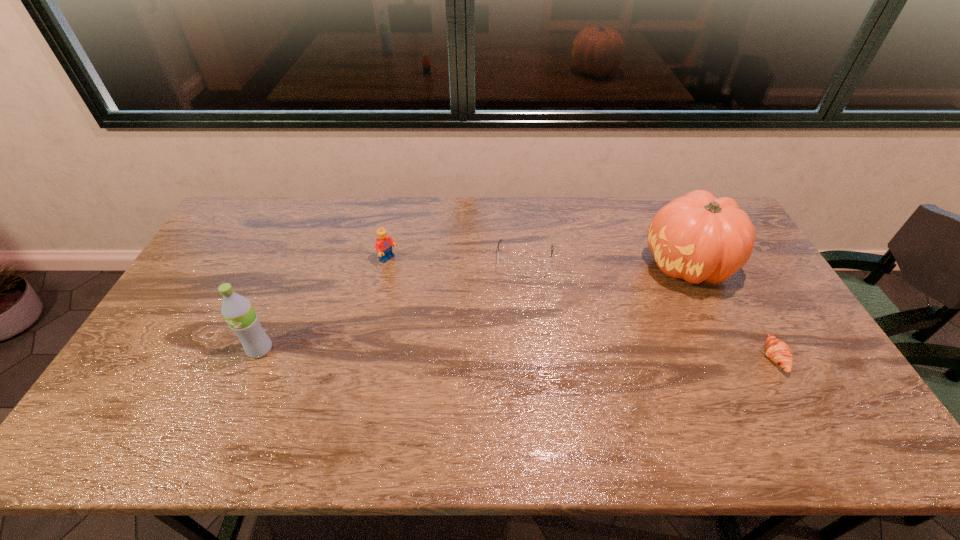
Locate an element on the screen. This screenshot has width=960, height=540. object at the far edge is located at coordinates (697, 237).

What are the coordinates of `pastry positioned at the right edge` in the screenshot? It's located at tap(778, 351).

Image resolution: width=960 pixels, height=540 pixels. I want to click on pumpkin located in the right edge section of the desktop, so click(697, 237).

Where is `object located in the far right corner section of the desktop`? The image size is (960, 540). object located in the far right corner section of the desktop is located at coordinates (697, 237).

This screenshot has height=540, width=960. In order to click on free space at the far edge of the desktop in this screenshot , I will do `click(464, 220)`.

The image size is (960, 540). In order to click on free spot at the near edge of the desktop in this screenshot , I will do `click(331, 385)`.

Identify the location of vacant space at the left edge of the desktop. (201, 316).

The width and height of the screenshot is (960, 540). Identify the location of blank area at the right edge. (762, 336).

At what (x,y) coordinates should I click in order to perform the action: click on unoccupied position between the pumpkin and the Lego. Please return your answer as a coordinate pair (x, y). This screenshot has height=540, width=960. Looking at the image, I should click on coord(539,262).

This screenshot has width=960, height=540. What are the coordinates of `empty space that is in between the third tallest object and the pastry` in the screenshot? It's located at coord(582,308).